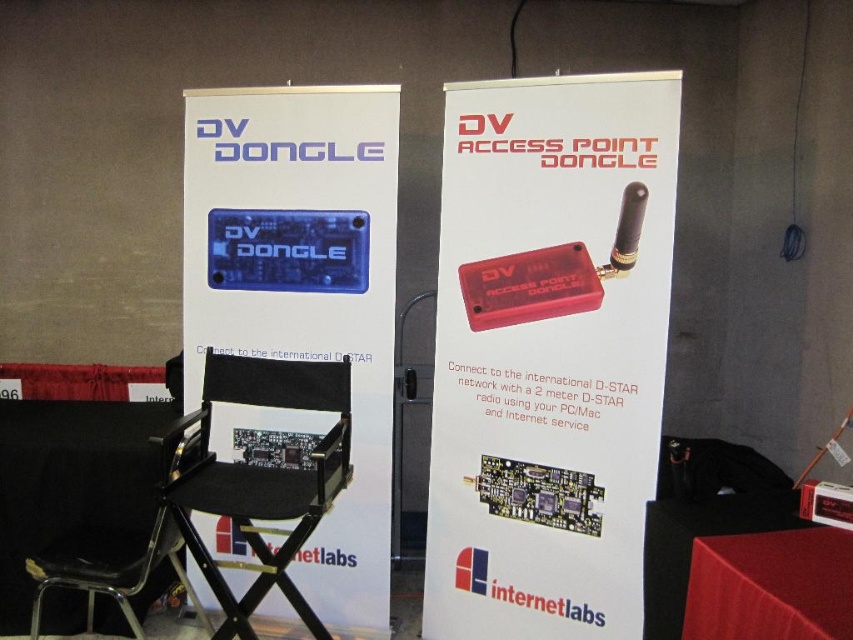
Consider the image. You are setting up a display for a tech exhibition and need to place two devices on a shelf. You have a red plastic dongle at center and a blue plastic dv dongle at center. If the shelf has limited depth, which device should you choose to fit better?

The red plastic dongle at center is thinner than the blue plastic dv dongle at center, so it would fit better on the shelf with limited depth.

You are attending a tech exhibition and see the red plastic dongle at center and the black fabric folding chair at center. Which object is closer to you?

The red plastic dongle at center is closer to you because it is further to the viewer than the black fabric folding chair at center.

You are standing at the point marked as point (444, 246). You need to reach the nearest banner. Which banner should you head towards?

The banners are 2.59 meters apart. Since you are at point (444, 246), you should head towards the nearest banner, but the description does not specify their positions relative to your location. Without additional spatial information about the banners and your position, it is impossible to determine which banner is closer.